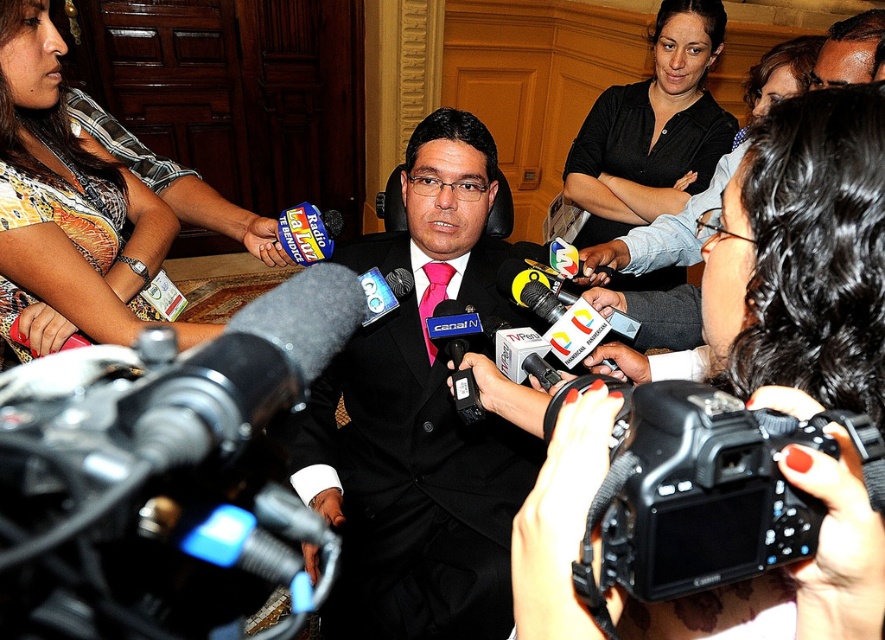
You are a photographer at the press conference. You want to capture a clear shot of the central speaker while avoiding the microphone nearest to you. Which point, point 1 at coordinates (682, 406) or point 2 at coordinates (86, 196), is closer to you and should be avoided to prevent obstruction?

Point 1 at coordinates (682, 406) is closer to the viewer, so it should be avoided to prevent obstruction.

You are a photographer at the event and need to capture a clear photo of the black suit at center without the black plastic camera at center blocking the view. Based on the distance between them, can you position yourself close enough to ensure the camera doesn

The distance between the black suit at center and the black plastic camera at center is 38.16 inches. Since this distance is sufficient, you can position yourself close enough to the black suit at center to avoid the black plastic camera at center blocking the view.

You are a photographer at the event and need to capture a clear photo of the black suit at center without the black plastic camera at center blocking the view. Can you adjust your position to the right to achieve this?

The black suit at center is positioned on the left side of the black plastic camera at center. Moving to the right would allow you to position the camera to the right of the subject, thus avoiding the obstruction.